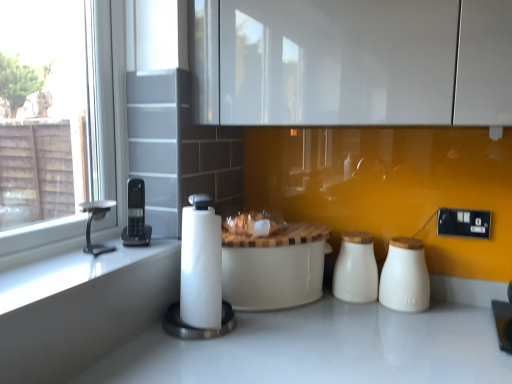
Identify the location of spots to the right of silver metallic faucet at left. Image resolution: width=512 pixels, height=384 pixels. (139, 252).